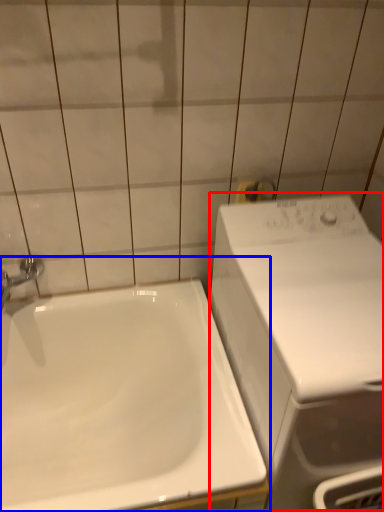
Question: Which object appears farthest to the camera in this image, washing machine (highlighted by a red box) or sink (highlighted by a blue box)?

Choices:
 (A) washing machine
 (B) sink

Answer: (B)